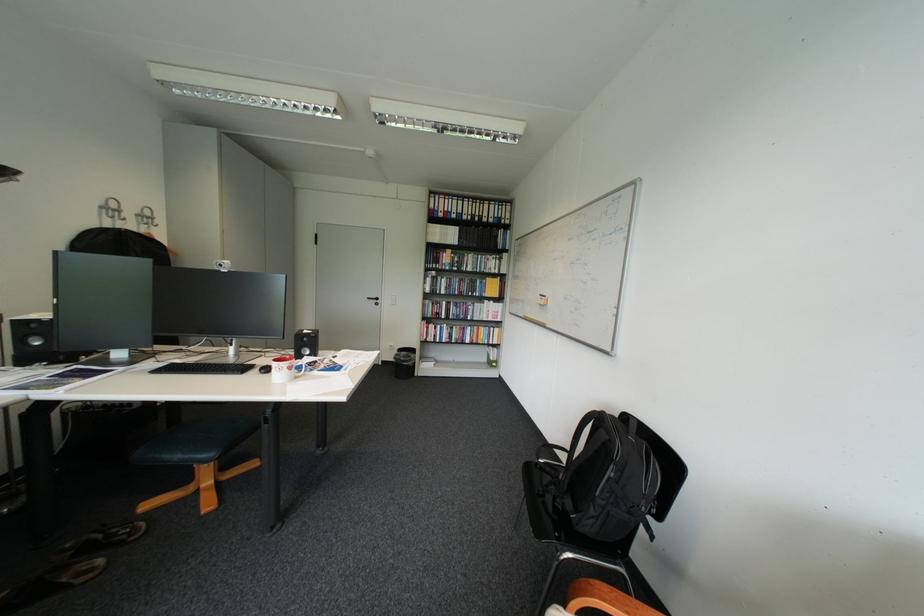
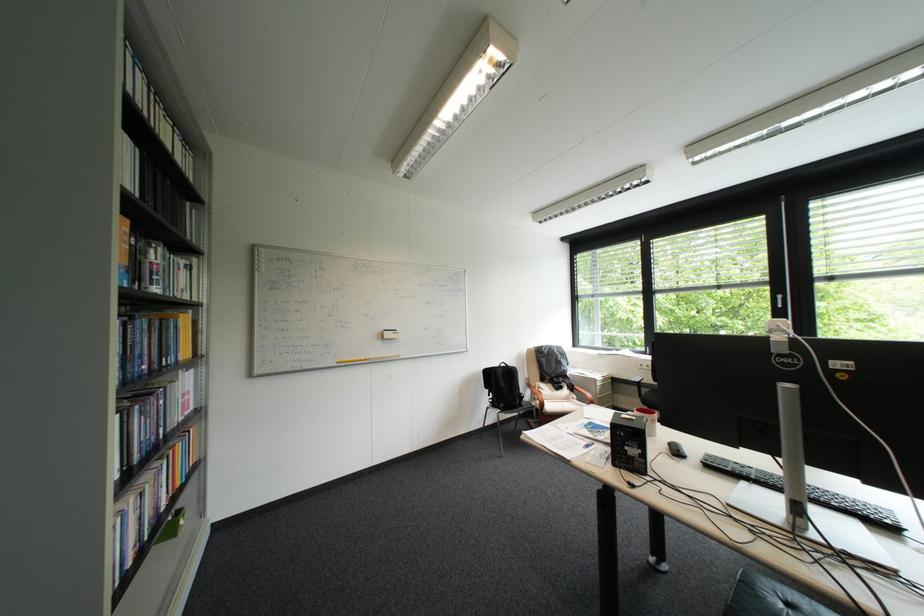
The point at (469, 281) is marked in the first image. Where is the corresponding point in the second image?

(159, 326)